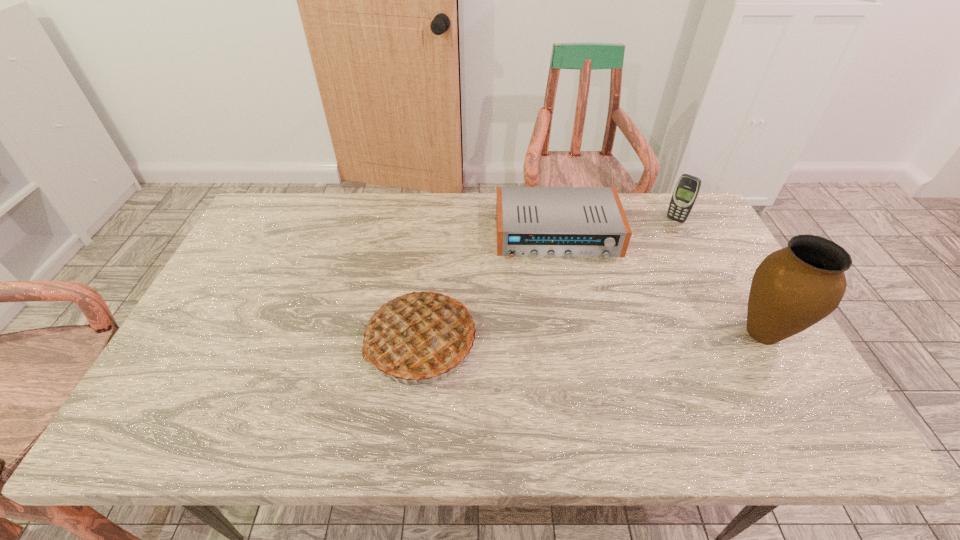
The image size is (960, 540). I want to click on free space at the far edge, so click(319, 208).

In the image, there is a desktop. Where is `blank space at the near edge`? This screenshot has height=540, width=960. blank space at the near edge is located at coordinates [307, 395].

Locate an element on the screen. The width and height of the screenshot is (960, 540). free space at the left edge of the desktop is located at coordinates (242, 308).

Locate an element on the screen. The height and width of the screenshot is (540, 960). vacant space at the right edge is located at coordinates (744, 307).

In the image, there is a desktop. At what (x,y) coordinates should I click in order to perform the action: click on vacant space at the far left corner. Please return your answer as a coordinate pair (x, y). Looking at the image, I should click on (289, 224).

Where is `free region at the near left corner of the desktop`? Image resolution: width=960 pixels, height=540 pixels. free region at the near left corner of the desktop is located at coordinates (174, 391).

This screenshot has height=540, width=960. Identify the location of vacant space at the far right corner of the desktop. (678, 225).

Identify the location of vacant point located between the radio receiver and the urn. This screenshot has height=540, width=960. (660, 284).

Locate an element on the screen. vacant space that's between the third shortest object and the tallest object is located at coordinates (592, 337).

Identify the location of free space between the tallest object and the cellular telephone. (719, 276).